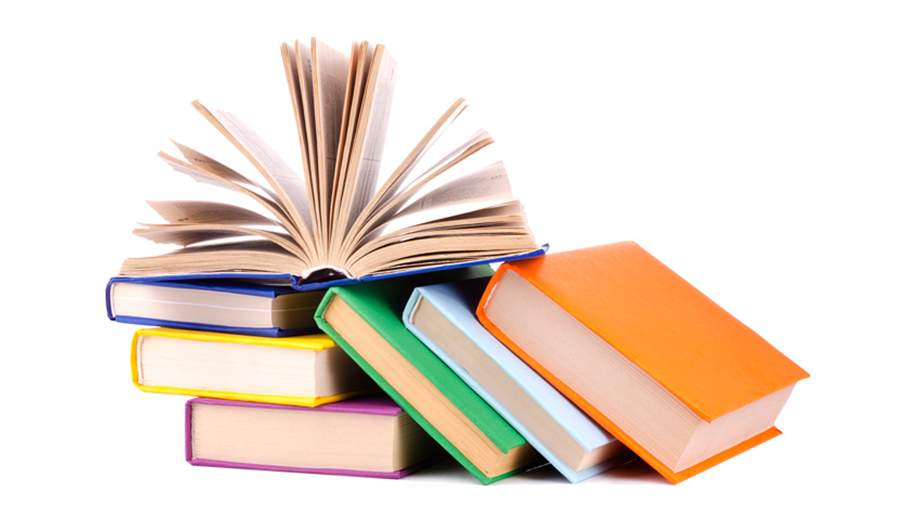
Locate an element on the screen. The width and height of the screenshot is (918, 516). books not propped diagonally is located at coordinates (277, 265), (258, 315), (260, 370), (273, 433).